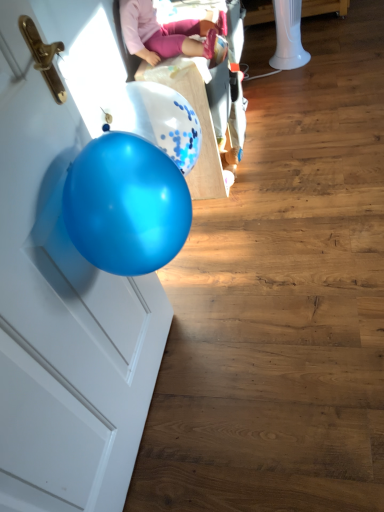
Where is `white plastic baby carriage at upper center`? The width and height of the screenshot is (384, 512). white plastic baby carriage at upper center is located at coordinates (166, 33).

This screenshot has height=512, width=384. What do you see at coordinates (62, 315) in the screenshot? I see `glossy blue balloon at left` at bounding box center [62, 315].

You are a GUI agent. You are given a task and a screenshot of the screen. Output one action in this format:
    pyautogui.click(x=<x>, y=<y>)
    Task: Click on the white plastic baby carriage at upper center
    
    Given the screenshot: What is the action you would take?
    pyautogui.click(x=166, y=33)

Considering the relative sizes of pink fabric doll at upper center and white plastic baby carriage at upper center in the image provided, is pink fabric doll at upper center wider than white plastic baby carriage at upper center?

Yes, pink fabric doll at upper center is wider than white plastic baby carriage at upper center.

In the image, is pink fabric doll at upper center positioned in front of or behind white plastic baby carriage at upper center?

Clearly, pink fabric doll at upper center is in front of white plastic baby carriage at upper center.

Is pink fabric doll at upper center oriented away from white plastic baby carriage at upper center?

No, pink fabric doll at upper center is not facing the opposite direction of white plastic baby carriage at upper center.

Between point (133, 20) and point (182, 29), which one is positioned in front?

Point (133, 20)

Is white plastic baby carriage at upper center in contact with pink fabric doll at upper center?

Yes, white plastic baby carriage at upper center is in contact with pink fabric doll at upper center.

From a real-world perspective, is white plastic baby carriage at upper center on top of pink fabric doll at upper center?

No, from a real-world perspective, white plastic baby carriage at upper center is not over pink fabric doll at upper center

Is point (169, 41) closer or farther from the camera than point (137, 11)?

Clearly, point (169, 41) is more distant from the camera than point (137, 11).

Could you tell me if white plastic baby carriage at upper center is turned towards glossy blue balloon at left?

No, white plastic baby carriage at upper center is not oriented towards glossy blue balloon at left.

Is white plastic baby carriage at upper center beside glossy blue balloon at left?

There is a gap between white plastic baby carriage at upper center and glossy blue balloon at left.

Does white plastic baby carriage at upper center come behind glossy blue balloon at left?

Yes, the depth of white plastic baby carriage at upper center is greater than that of glossy blue balloon at left.

Could you tell me if glossy blue balloon at left is facing white plastic baby carriage at upper center?

No.

Relative to white plastic baby carriage at upper center, is glossy blue balloon at left in front or behind?

Visually, glossy blue balloon at left is located in front of white plastic baby carriage at upper center.

Based on their sizes in the image, would you say glossy blue balloon at left is bigger or smaller than white plastic baby carriage at upper center?

Considering their sizes, glossy blue balloon at left takes up less space than white plastic baby carriage at upper center.

Consider the image. Does glossy blue balloon at left have a lesser height compared to pink fabric doll at upper center?

No.

From the image's perspective, is glossy blue balloon at left beneath pink fabric doll at upper center?

Yes, from the image's perspective, glossy blue balloon at left is beneath pink fabric doll at upper center.

Could you tell me if glossy blue balloon at left is facing pink fabric doll at upper center?

No, glossy blue balloon at left does not turn towards pink fabric doll at upper center.

Is pink fabric doll at upper center smaller than glossy blue balloon at left?

Yes, pink fabric doll at upper center is smaller than glossy blue balloon at left.

In terms of width, does pink fabric doll at upper center look wider or thinner when compared to glossy blue balloon at left?

In the image, pink fabric doll at upper center appears to be wider than glossy blue balloon at left.

Considering the sizes of objects pink fabric doll at upper center and glossy blue balloon at left in the image provided, who is shorter, pink fabric doll at upper center or glossy blue balloon at left?

With less height is pink fabric doll at upper center.

This screenshot has width=384, height=512. Identify the location of door lying in front of the pink fabric doll at upper center. (62, 315).

Where is `person in front of the white plastic baby carriage at upper center`? This screenshot has width=384, height=512. person in front of the white plastic baby carriage at upper center is located at coordinates (166, 33).

You are a GUI agent. You are given a task and a screenshot of the screen. Output one action in this format:
    pyautogui.click(x=<x>, y=<y>)
    Task: Click on the baby carriage below the pink fabric doll at upper center (from the image's perspective)
    
    Given the screenshot: What is the action you would take?
    pyautogui.click(x=166, y=33)

Estimate the real-world distances between objects in this image. Which object is further from white plastic baby carriage at upper center, glossy blue balloon at left or pink fabric doll at upper center?

The object further to white plastic baby carriage at upper center is glossy blue balloon at left.

Estimate the real-world distances between objects in this image. Which object is closer to white plastic baby carriage at upper center, pink fabric doll at upper center or glossy blue balloon at left?

Among the two, pink fabric doll at upper center is located nearer to white plastic baby carriage at upper center.

Estimate the real-world distances between objects in this image. Which object is closer to glossy blue balloon at left, white plastic baby carriage at upper center or pink fabric doll at upper center?

Among the two, pink fabric doll at upper center is located nearer to glossy blue balloon at left.

From the image, which object appears to be farther from pink fabric doll at upper center, glossy blue balloon at left or white plastic baby carriage at upper center?

Among the two, glossy blue balloon at left is located further to pink fabric doll at upper center.

When comparing their distances from glossy blue balloon at left, does pink fabric doll at upper center or white plastic baby carriage at upper center seem further?

white plastic baby carriage at upper center is further to glossy blue balloon at left.

Based on their spatial positions, is white plastic baby carriage at upper center or glossy blue balloon at left closer to pink fabric doll at upper center?

white plastic baby carriage at upper center.

Image resolution: width=384 pixels, height=512 pixels. Identify the location of person between glossy blue balloon at left and white plastic baby carriage at upper center from front to back. (166, 33).